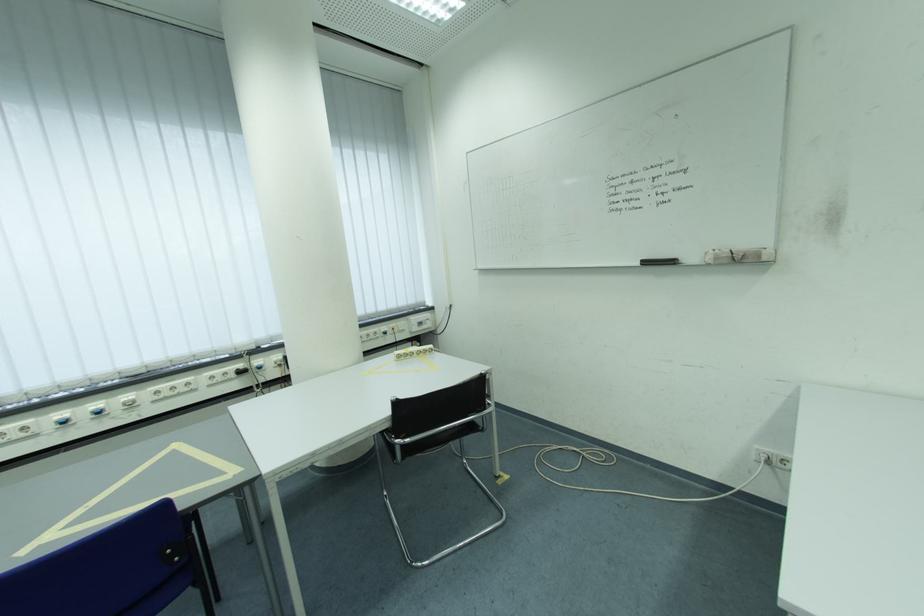
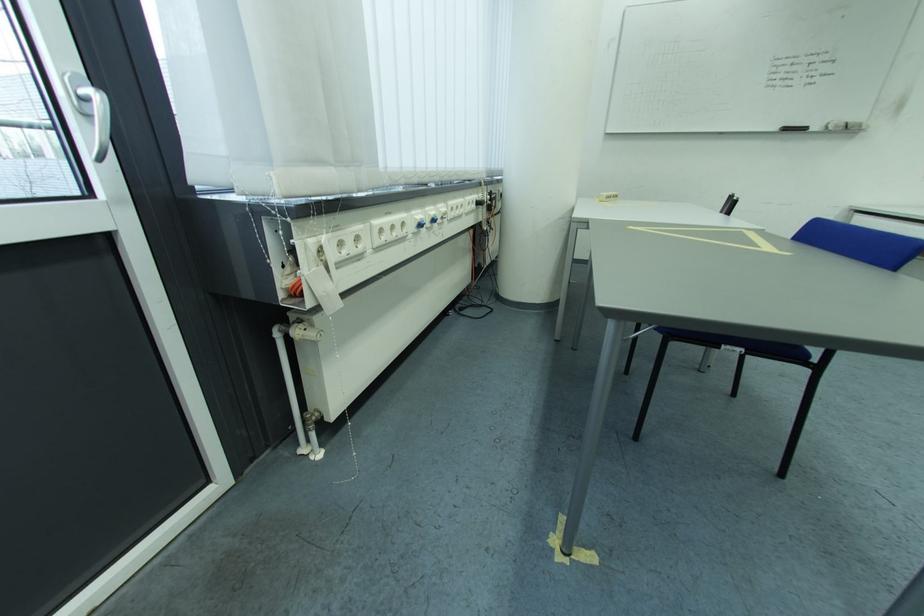
In the second image, find the point that corresponds to point (725, 261) in the first image.

(845, 129)